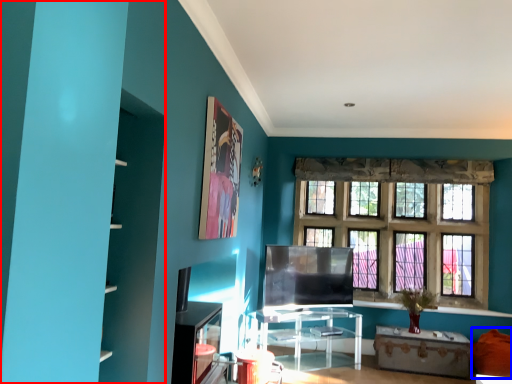
Question: Which object is closer to the camera taking this photo, bookshelf (highlighted by a red box) or couch (highlighted by a blue box)?

Choices:
 (A) bookshelf
 (B) couch

Answer: (A)